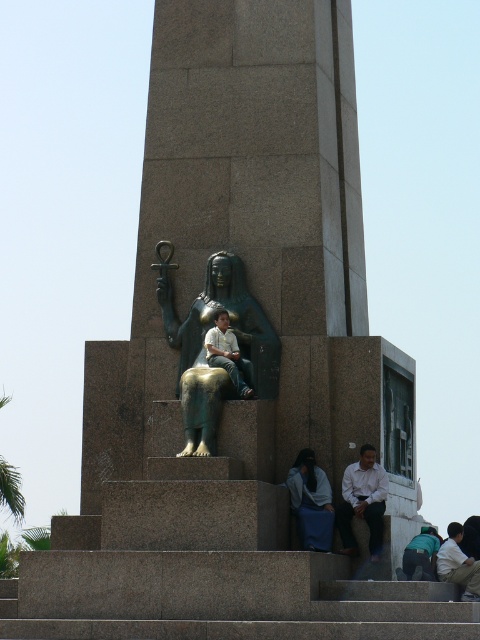
Question: Which point appears farthest from the camera in this image?

Choices:
 (A) (235, 273)
 (B) (451, 564)
 (C) (232, 365)
 (D) (385, 472)

Answer: (A)

Question: Which point appears farthest from the camera in this image?

Choices:
 (A) (344, 525)
 (B) (227, 310)
 (C) (452, 566)
 (D) (298, 529)

Answer: (C)

Question: Is bronze statue at center bigger than blue fabric at lower center?

Choices:
 (A) yes
 (B) no

Answer: (A)

Question: Can you confirm if light brown fabric jacket at lower right is positioned below teal fabric backpack at lower right?

Choices:
 (A) yes
 (B) no

Answer: (A)

Question: Does blue fabric at lower center appear on the right side of teal fabric backpack at lower right?

Choices:
 (A) no
 (B) yes

Answer: (A)

Question: Among these points, which one is farthest from the camera?

Choices:
 (A) (456, 547)
 (B) (235, 260)
 (C) (380, 515)

Answer: (A)